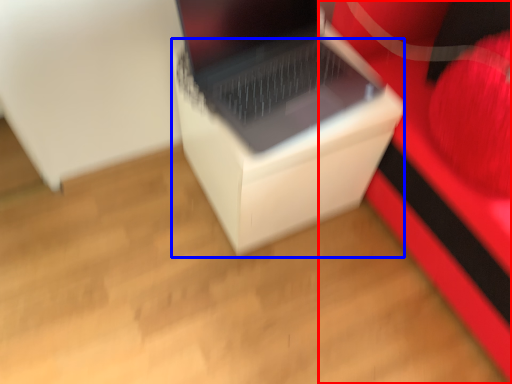
Question: Which of the following is the closest to the observer, furniture (highlighted by a red box) or cardboard box (highlighted by a blue box)?

Choices:
 (A) furniture
 (B) cardboard box

Answer: (A)